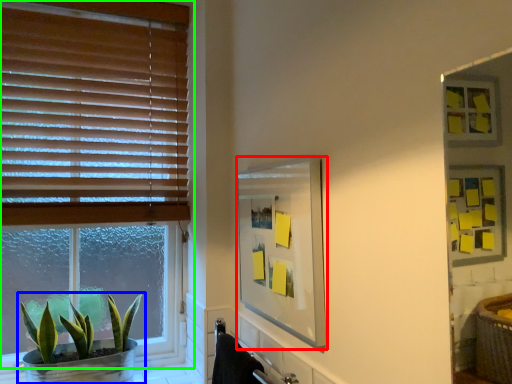
Question: Based on their relative distances, which object is farther from mirror (highlighted by a red box)? Choose from houseplant (highlighted by a blue box) and window (highlighted by a green box).

Choices:
 (A) houseplant
 (B) window

Answer: (A)